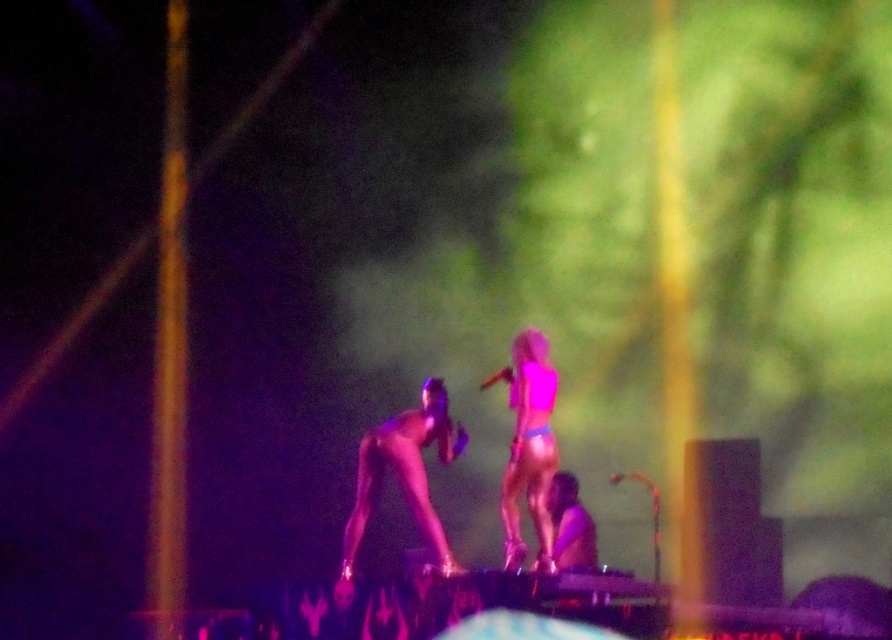
You are a photographer at the concert. You want to take a photo that captures both the shiny metallic pole at center and the pink matte bikini at center in the same frame. Given that your camera has a minimum focus distance of 20 inches, will you be able to focus on both objects if they are 23.28 inches apart?

The shiny metallic pole at center and the pink matte bikini at center are 23.28 inches apart from each other. Since the minimum focus distance is 20 inches, the camera can focus on both objects as the distance between them is greater than the minimum requirement.

You are a photographer at the concert. You want to take a closeup shot of the pink matte bikini at center without the shiny metallic pole at center blocking the view. Is it possible to do so given their sizes?

The shiny metallic pole at center is bigger than the pink matte bikini at center, so it might block the view. However, since both are at the center, adjusting the camera angle slightly might allow focusing on the bikini while avoiding the pole.